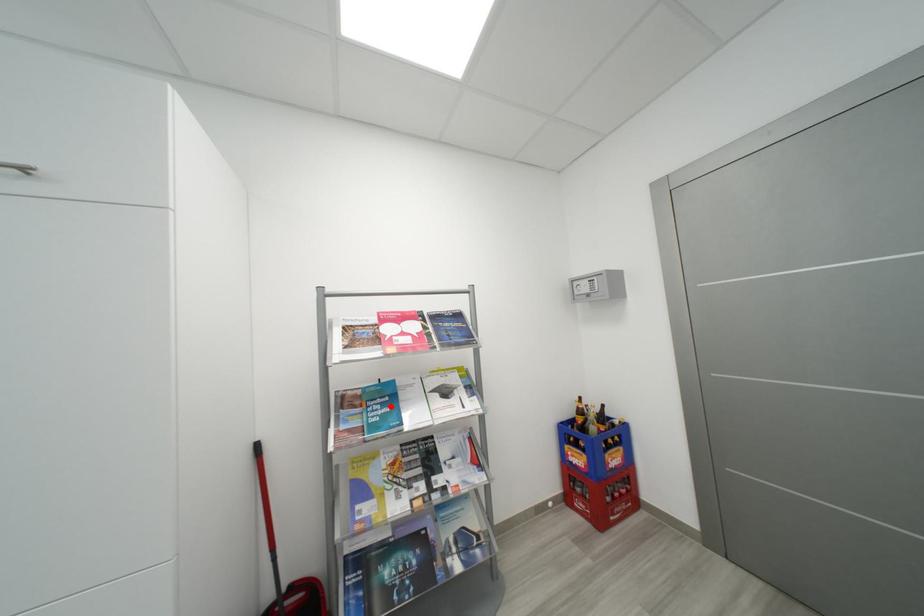
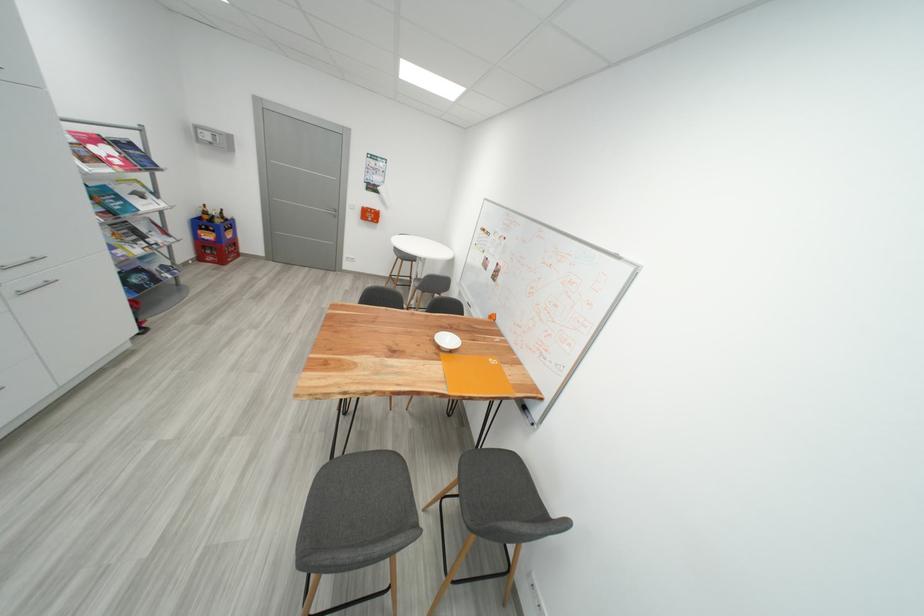
Where in the second image is the point corresponding to the highlighted location from the first image?

(122, 201)